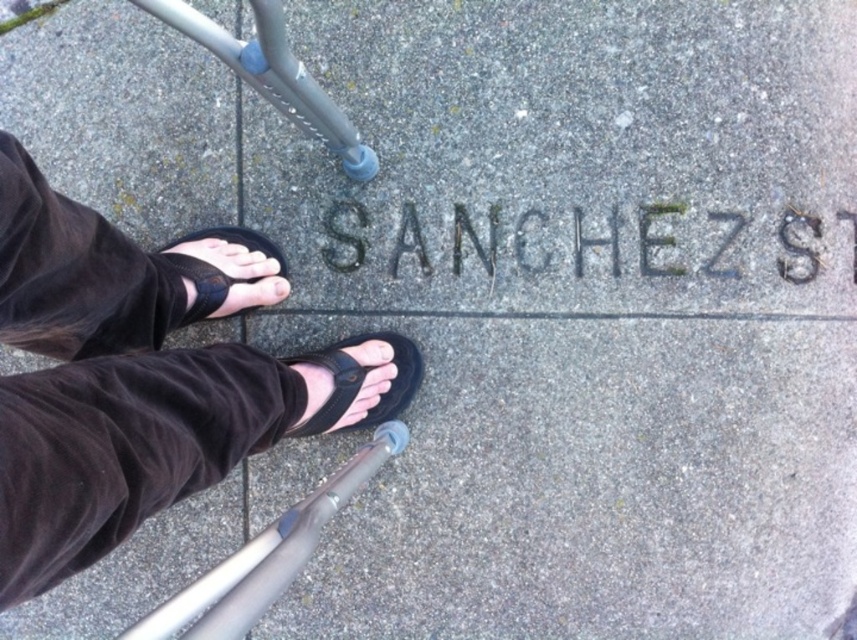
You are a delivery person trying to place a small package on the ground between the black leather sandals at center and the silver metallic crutch at lower left. Can you fit the package there if it measures 10 cm in width?

The black leather sandals at center has a lesser width compared to silver metallic crutch at lower left. Since the package is 10 cm wide, it might fit between them, but the exact space depends on the distance between the two objects. However, the description only mentions their widths, not the space between them. Without knowing the distance between the sandals and the crutch, we cannot confirm if the package will fit.

You are standing on the sidewalk looking at the engraving of SANCHEZ ST. There are two points marked on the ground. Which point is closer to you, point (213, 621) or point (280, 276)?

Point (213, 621) is closer to you than point (280, 276).